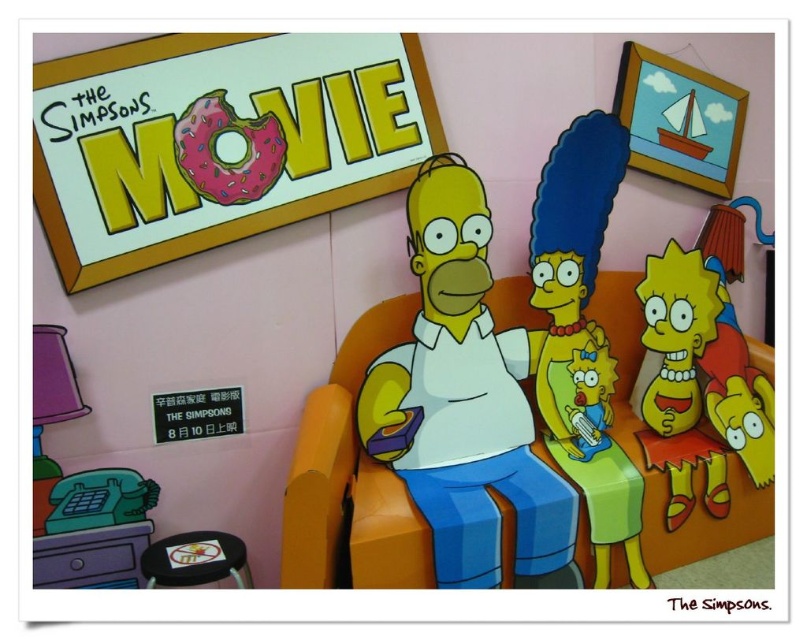
In the living room scene from The Simpsons Movie, you notice an orange matte armchair at center and a pink frosted donut at upper left. Which object is wider?

The orange matte armchair at center is wider than the pink frosted donut at upper left.

In the living room scene from The Simpsons Movie, you are trying to rearrange the furniture. You need to place both the yellow matte Homer Simpson at center and the orange matte armchair at center in a smaller space. Which object should you prioritize moving first to save space?

You should prioritize moving the yellow matte Homer Simpson at center first because it occupies less space than the orange matte armchair at center, making it easier to rearrange in a smaller area.